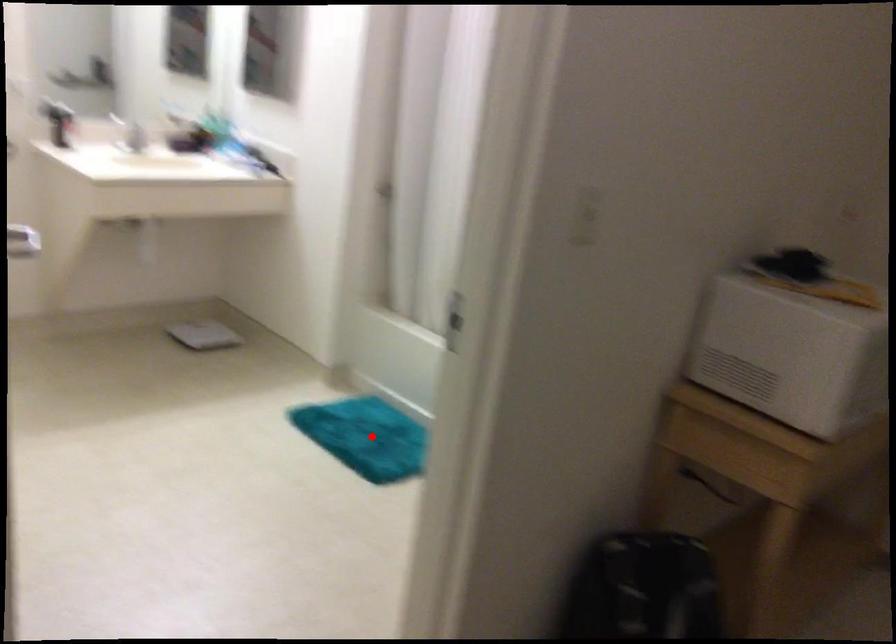
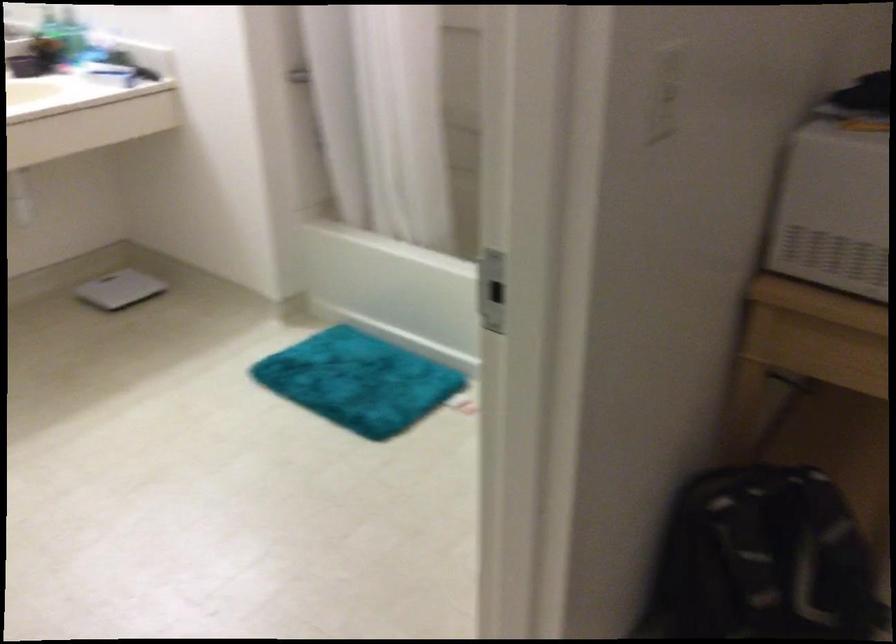
Question: A red point is marked in image1. In image2, is the corresponding 3D point closer to the camera or farther? Reply with the corresponding letter.

Choices:
 (A) The corresponding 3D point is closer.
 (B) The corresponding 3D point is farther.

Answer: (A)